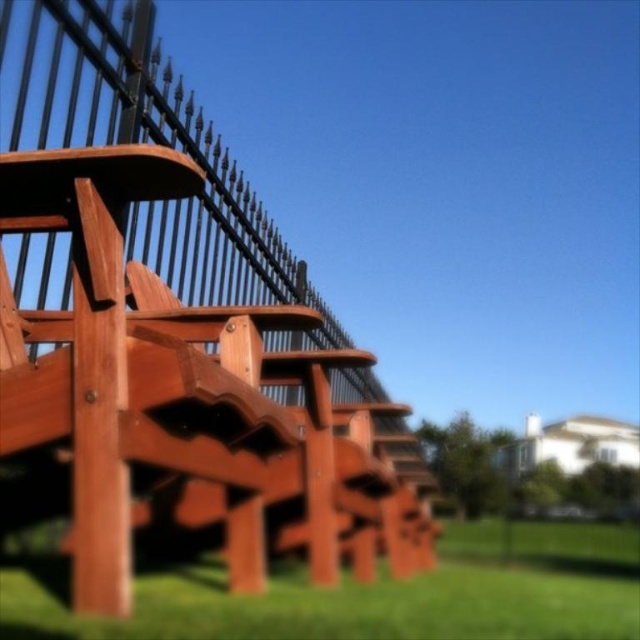
Which is in front, point (221, 188) or point (474, 536)?

Point (221, 188)

Is brown wood fence at upper left smaller than green grass at lower center?

Correct, brown wood fence at upper left occupies less space than green grass at lower center.

Identify the location of brown wood fence at upper left. 150,144.

You are a GUI agent. You are given a task and a screenshot of the screen. Output one action in this format:
    pyautogui.click(x=<x>, y=<y>)
    Task: Click on the brown wood fence at upper left
    This screenshot has height=640, width=640.
    Given the screenshot: What is the action you would take?
    pyautogui.click(x=150, y=144)